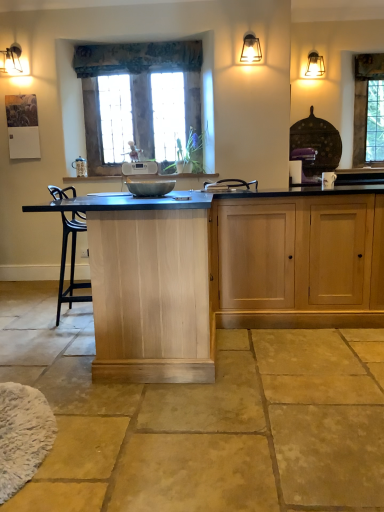
The height and width of the screenshot is (512, 384). In order to click on vacant space in front of natural wood cabinet at center in this screenshot , I will do `click(163, 422)`.